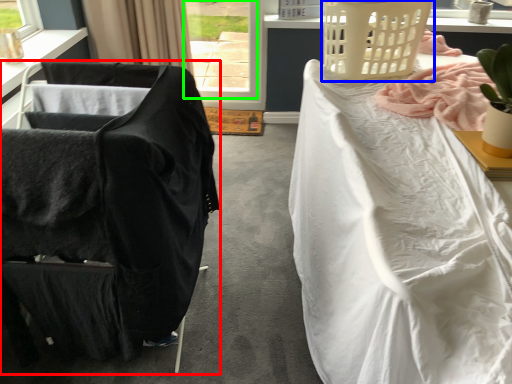
Question: Estimate the real-world distances between objects in this image. Which object is farther from chair (highlighted by a red box), basket (highlighted by a blue box) or window (highlighted by a green box)?

Choices:
 (A) basket
 (B) window

Answer: (B)